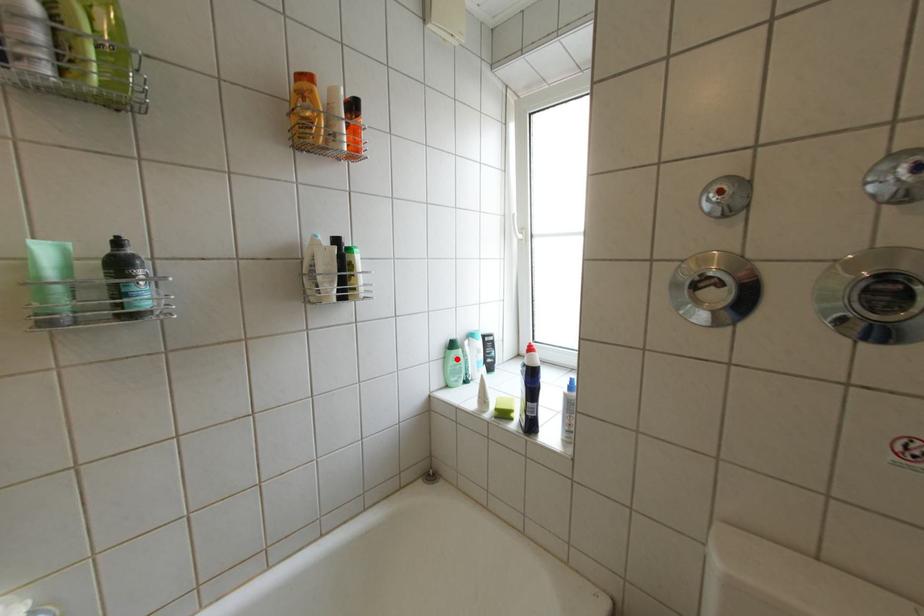
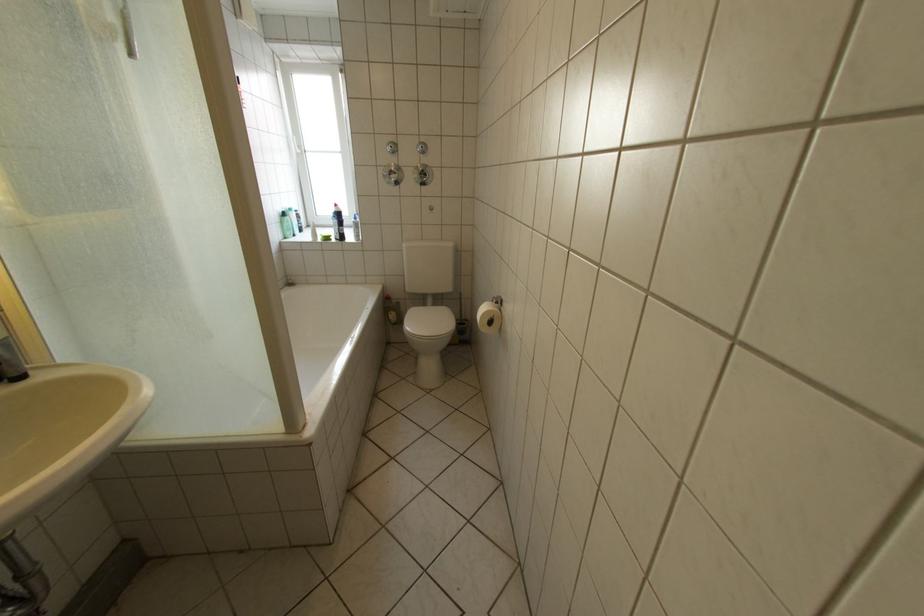
In the second image, find the point that corresponds to the highlighted location in the first image.

(294, 224)